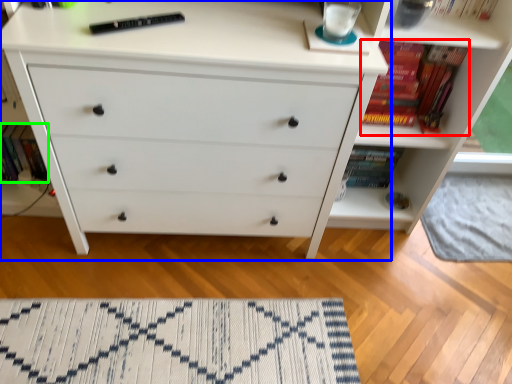
Question: Which object is the farthest from book (highlighted by a red box)? Choose among these: chest of drawers (highlighted by a blue box) or book (highlighted by a green box).

Choices:
 (A) chest of drawers
 (B) book

Answer: (B)